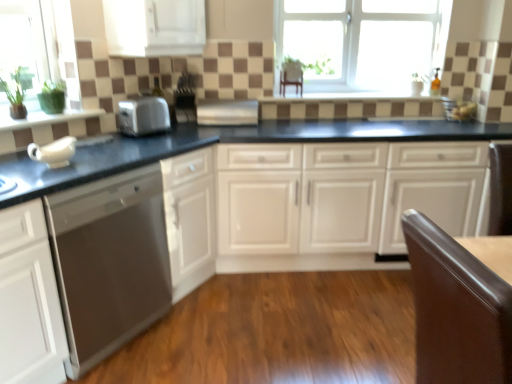
Find the location of a particular element. Image resolution: width=512 pixels, height=384 pixels. free point in front of satin silver toaster at center, which appears as the first appliance when viewed from the right is located at coordinates (210, 137).